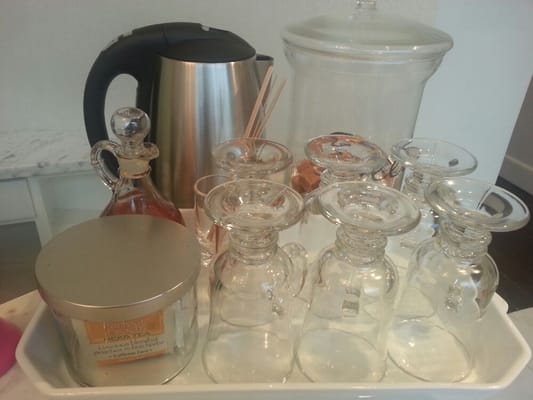
This screenshot has width=533, height=400. Find the location of `wooden stirrers`. wooden stirrers is located at coordinates (254, 111), (263, 118), (264, 125).